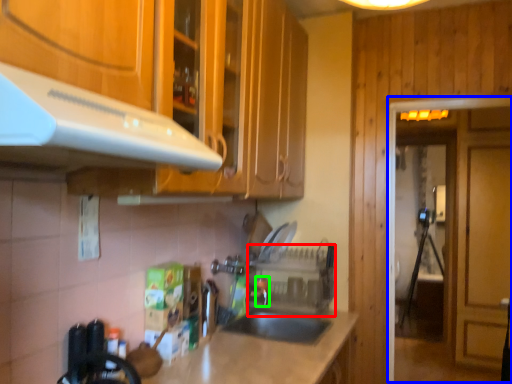
Question: Based on their relative distances, which object is farther from appliance (highlighted by a red box)? Choose from glass door (highlighted by a blue box) and faucet (highlighted by a green box).

Choices:
 (A) glass door
 (B) faucet

Answer: (A)